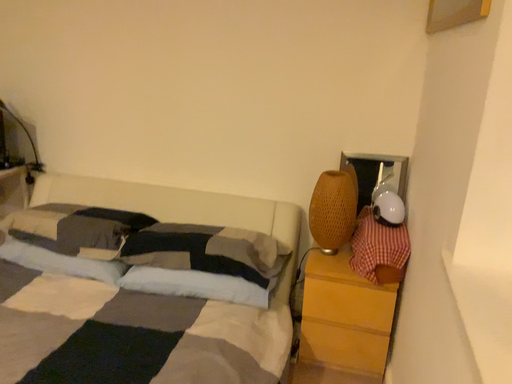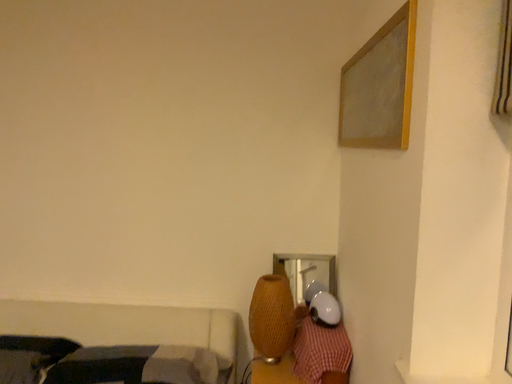
Question: How did the camera likely rotate when shooting the video?

Choices:
 (A) rotated downward
 (B) rotated upward

Answer: (B)